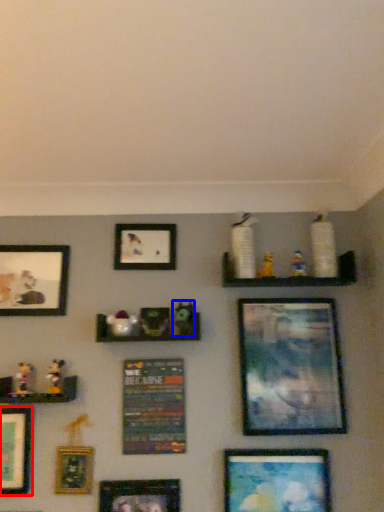
Question: Among these objects, which one is nearest to the camera, picture frame (highlighted by a red box) or toy (highlighted by a blue box)?

Choices:
 (A) picture frame
 (B) toy

Answer: (A)